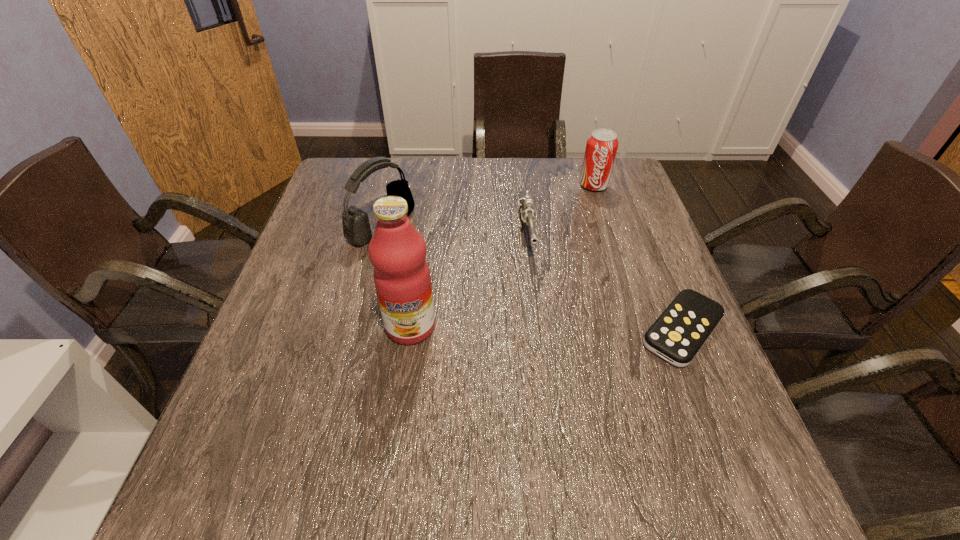
I want to click on remote control that is at the right edge, so click(x=678, y=334).

Image resolution: width=960 pixels, height=540 pixels. Find the location of `soda can situated at the right edge`. soda can situated at the right edge is located at coordinates (601, 148).

Locate an element on the screen. This screenshot has width=960, height=540. object positioned at the far right corner is located at coordinates (601, 148).

In the image, there is a desktop. Identify the location of vacant space at the far edge. The width and height of the screenshot is (960, 540). (509, 168).

Locate an element on the screen. Image resolution: width=960 pixels, height=540 pixels. free spot at the near edge of the desktop is located at coordinates (568, 429).

Locate an element on the screen. free space at the left edge of the desktop is located at coordinates (278, 322).

In order to click on vacant space at the right edge of the desktop in this screenshot , I will do `click(645, 321)`.

Identify the location of vacant space at the far left corner of the desktop. (352, 164).

In the image, there is a desktop. At what (x,y) coordinates should I click in order to perform the action: click on free space at the near left corner. Please return your answer as a coordinate pair (x, y). Looking at the image, I should click on (262, 416).

At what (x,y) coordinates should I click in order to perform the action: click on unoccupied position between the gun and the headset. Please return your answer as a coordinate pair (x, y). Looking at the image, I should click on (454, 229).